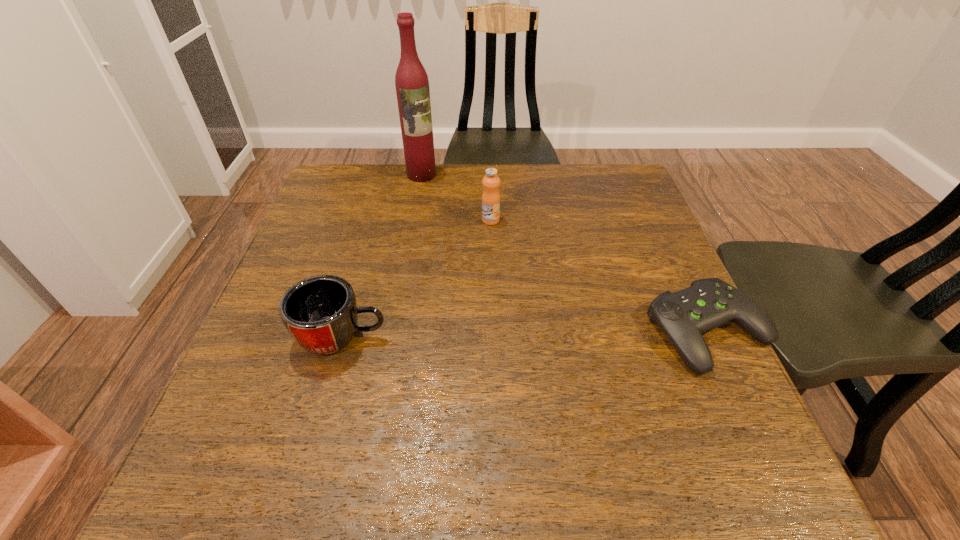
The width and height of the screenshot is (960, 540). I want to click on mug, so click(x=320, y=313).

In order to click on the shortest object in this screenshot , I will do [684, 315].

Image resolution: width=960 pixels, height=540 pixels. I want to click on the rightmost object, so click(x=684, y=315).

Where is `orange juice`? orange juice is located at coordinates (491, 197).

At what (x,y) coordinates should I click in order to perform the action: click on the second tallest object. Please return your answer as a coordinate pair (x, y). Image resolution: width=960 pixels, height=540 pixels. Looking at the image, I should click on (491, 197).

The width and height of the screenshot is (960, 540). Identify the location of the farthest object. (411, 80).

Locate an element on the screen. The width and height of the screenshot is (960, 540). the tallest object is located at coordinates (411, 80).

I want to click on vacant space located on the side of the second shortest object with the handle, so click(582, 336).

Find the location of a particular element. vacant space situated on the back of the rightmost object is located at coordinates (646, 199).

Locate an element on the screen. The height and width of the screenshot is (540, 960). vacant space situated on the front label of the second farthest object is located at coordinates (486, 355).